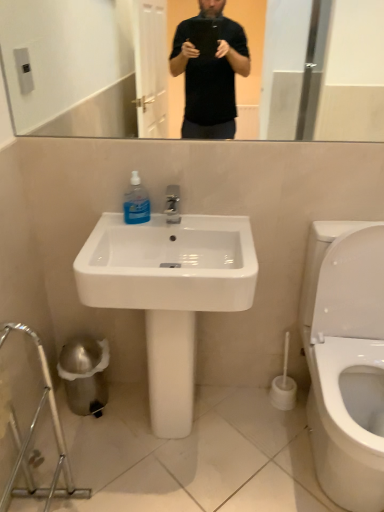
Question: Is white glossy sink at center at the left side of white plastic toilet brush at lower right?

Choices:
 (A) yes
 (B) no

Answer: (A)

Question: Considering the relative sizes of white glossy sink at center and white plastic toilet brush at lower right in the image provided, is white glossy sink at center thinner than white plastic toilet brush at lower right?

Choices:
 (A) yes
 (B) no

Answer: (B)

Question: Is white glossy sink at center positioned far away from white plastic toilet brush at lower right?

Choices:
 (A) no
 (B) yes

Answer: (A)

Question: Is white glossy sink at center looking in the opposite direction of white plastic toilet brush at lower right?

Choices:
 (A) yes
 (B) no

Answer: (B)

Question: Is white glossy sink at center directly adjacent to white plastic toilet brush at lower right?

Choices:
 (A) yes
 (B) no

Answer: (B)

Question: Is white glossy sink at center located outside white plastic toilet brush at lower right?

Choices:
 (A) no
 (B) yes

Answer: (B)

Question: Is white plastic toilet brush at lower right far from white glossy sink at center?

Choices:
 (A) yes
 (B) no

Answer: (B)

Question: Does white plastic toilet brush at lower right have a greater width compared to white glossy sink at center?

Choices:
 (A) no
 (B) yes

Answer: (A)

Question: Is white plastic toilet brush at lower right facing away from white glossy sink at center?

Choices:
 (A) yes
 (B) no

Answer: (B)

Question: Could you tell me if white plastic toilet brush at lower right is turned towards white glossy sink at center?

Choices:
 (A) yes
 (B) no

Answer: (B)

Question: From the image's perspective, is white plastic toilet brush at lower right on top of white glossy sink at center?

Choices:
 (A) yes
 (B) no

Answer: (B)

Question: Is white plastic toilet brush at lower right located outside white glossy sink at center?

Choices:
 (A) no
 (B) yes

Answer: (B)

Question: From the image's perspective, is white plastic toilet brush at lower right under blue translucent liquid at sink?

Choices:
 (A) no
 (B) yes

Answer: (B)